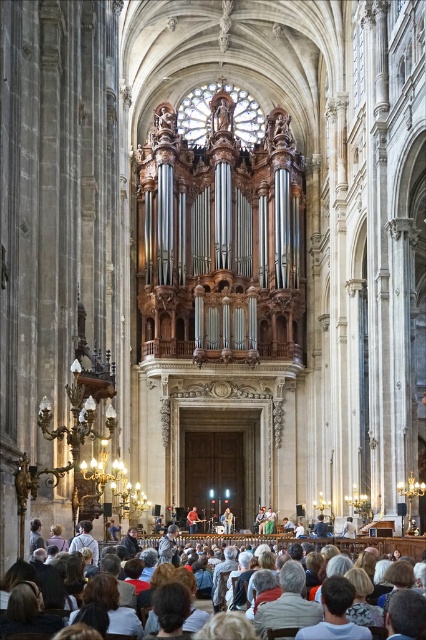
You are a stagehand in the cathedral and need to move a 1.5 meter wide stage prop from the light brown wooden chairs at lower center to the red shirt at lower center. Is there enough space to move the prop without touching either object?

The distance between the light brown wooden chairs at lower center and the red shirt at lower center is 17.17 meters, which is significantly wider than the 1.5 meter width of the stage prop. Therefore, there is ample space to move the prop without touching either object.

You are a photographer standing in the cathedral and want to take a picture of the red shirt at lower center without the light brown wooden chairs at lower center blocking it. Can you move the chairs to the side to get a clear shot?

The light brown wooden chairs at lower center might be wider than red shirt at lower center, so moving them might be necessary to avoid obstruction.

You are a photographer standing at the front of the cathedral during a performance. You need to capture a clear shot of the red shirt at lower center without the light brown wooden chairs at lower center blocking the view. Is this possible given their positions and sizes?

The light brown wooden chairs at lower center are taller than the red shirt at lower center, so they may obstruct the view of the red shirt at lower center. Adjust your position or angle to ensure the red shirt at lower center is visible above the chairs.